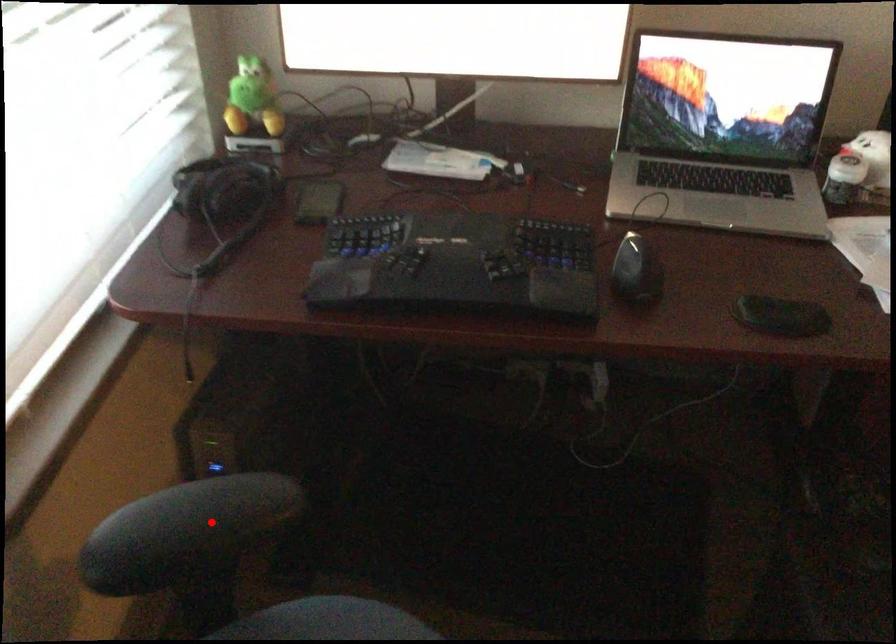
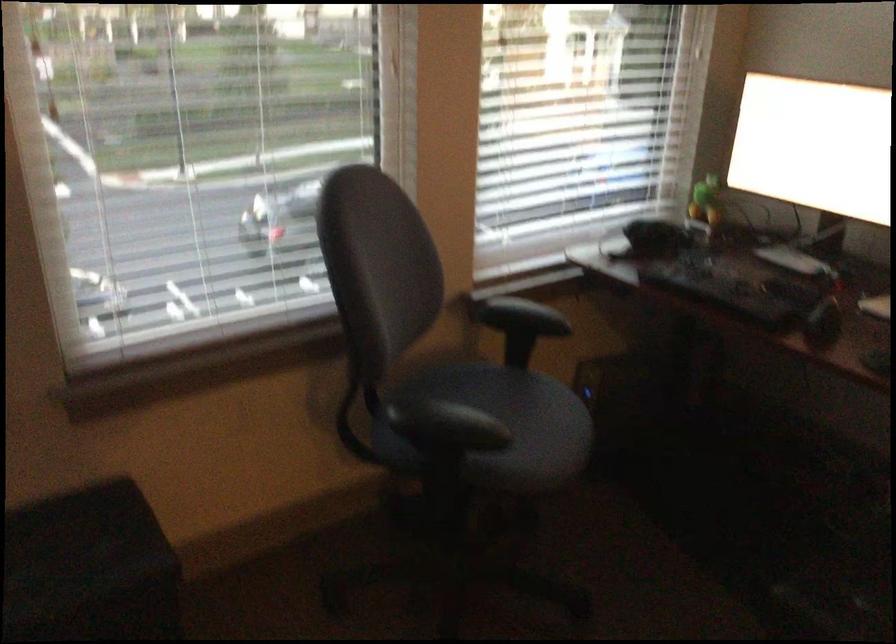
Where in the second image is the point corresponding to the highlighted location from the first image?

(523, 315)